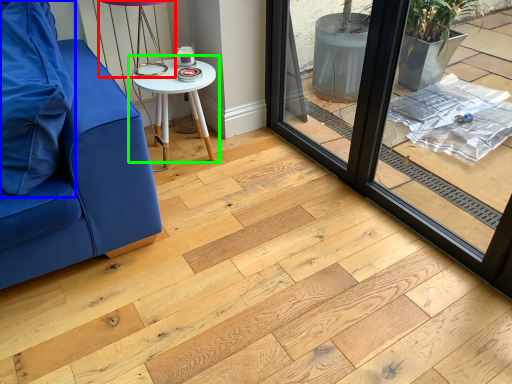
Question: Based on their relative distances, which object is farther from table lamp (highlighted by a red box)? Choose from pillow (highlighted by a blue box) and table (highlighted by a green box).

Choices:
 (A) pillow
 (B) table

Answer: (A)